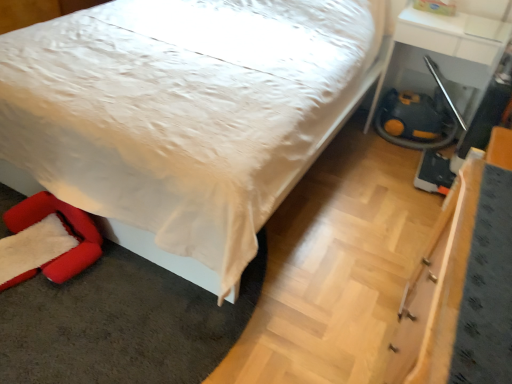
Question: Is the position of white glossy table at lower right more distant than that of white satin bed at center?

Choices:
 (A) yes
 (B) no

Answer: (A)

Question: Is white glossy table at lower right located outside white satin bed at center?

Choices:
 (A) yes
 (B) no

Answer: (A)

Question: Does white glossy table at lower right touch white satin bed at center?

Choices:
 (A) yes
 (B) no

Answer: (B)

Question: Does white glossy table at lower right have a greater width compared to white satin bed at center?

Choices:
 (A) yes
 (B) no

Answer: (B)

Question: Does white glossy table at lower right appear on the left side of white satin bed at center?

Choices:
 (A) yes
 (B) no

Answer: (B)

Question: Is white glossy table at lower right at the right side of white satin bed at center?

Choices:
 (A) yes
 (B) no

Answer: (A)

Question: Is white satin bed at center looking in the opposite direction of white glossy table at lower right?

Choices:
 (A) no
 (B) yes

Answer: (A)

Question: Can we say white satin bed at center lies outside white glossy table at lower right?

Choices:
 (A) yes
 (B) no

Answer: (A)

Question: Is the position of white satin bed at center less distant than that of white glossy table at lower right?

Choices:
 (A) no
 (B) yes

Answer: (B)

Question: From a real-world perspective, is white satin bed at center beneath white glossy table at lower right?

Choices:
 (A) no
 (B) yes

Answer: (A)

Question: Would you say white satin bed at center is a long distance from white glossy table at lower right?

Choices:
 (A) yes
 (B) no

Answer: (B)

Question: Are white satin bed at center and white glossy table at lower right beside each other?

Choices:
 (A) no
 (B) yes

Answer: (A)

Question: Does velvet red swivel chair at lower left appear on the left side of white satin bed at center?

Choices:
 (A) no
 (B) yes

Answer: (B)